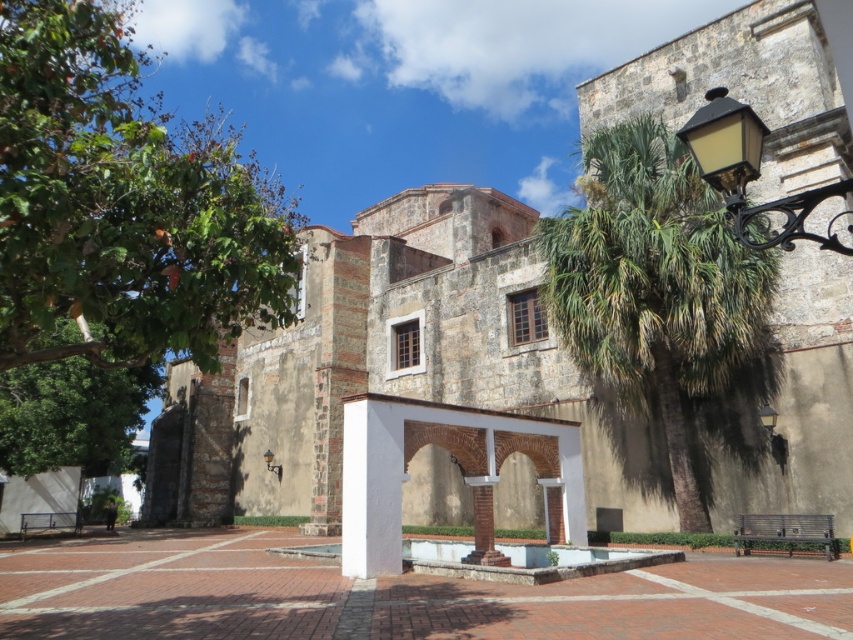
You are standing in the courtyard of the historical stone building and want to take a photo of the green leafy tree at upper left. Based on its 2D coordinates, where should you position yourself to ensure it fits in the frame?

The green leafy tree at upper left is located at coordinates 0.322 on the x axis and 0.144 on the y axis, so you should position yourself to the lower right of the tree to capture it within the frame.

You are standing in the courtyard of the historical stone building. You see a green leafy palm at right and a matte black lamp at center. Which object is taller?

The green leafy palm at right is taller than the matte black lamp at center.

You are standing in the courtyard of the historical stone building. You see a point marked at coordinates (654, 288). What does this point represent?

The point at (654, 288) represents the green leafy palm at right.